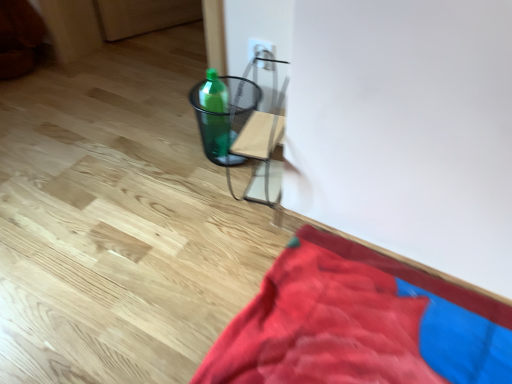
Question: Is velvet red blanket at lower right smaller than white plastic electric outlet at upper center?

Choices:
 (A) yes
 (B) no

Answer: (B)

Question: Is velvet red blanket at lower right positioned far away from white plastic electric outlet at upper center?

Choices:
 (A) yes
 (B) no

Answer: (B)

Question: Does velvet red blanket at lower right have a larger size compared to white plastic electric outlet at upper center?

Choices:
 (A) no
 (B) yes

Answer: (B)

Question: Considering the relative positions of velvet red blanket at lower right and white plastic electric outlet at upper center in the image provided, is velvet red blanket at lower right to the right of white plastic electric outlet at upper center from the viewer's perspective?

Choices:
 (A) yes
 (B) no

Answer: (A)

Question: From the image's perspective, is velvet red blanket at lower right over white plastic electric outlet at upper center?

Choices:
 (A) no
 (B) yes

Answer: (A)

Question: Can you confirm if velvet red blanket at lower right is wider than white plastic electric outlet at upper center?

Choices:
 (A) no
 (B) yes

Answer: (B)

Question: Does green plastic bottle at center have a lesser height compared to velvet red blanket at lower right?

Choices:
 (A) yes
 (B) no

Answer: (B)

Question: From a real-world perspective, is green plastic bottle at center on velvet red blanket at lower right?

Choices:
 (A) yes
 (B) no

Answer: (A)

Question: Can you confirm if green plastic bottle at center is smaller than velvet red blanket at lower right?

Choices:
 (A) no
 (B) yes

Answer: (B)

Question: Can you confirm if green plastic bottle at center is positioned to the right of velvet red blanket at lower right?

Choices:
 (A) no
 (B) yes

Answer: (A)

Question: Is velvet red blanket at lower right a part of green plastic bottle at center?

Choices:
 (A) yes
 (B) no

Answer: (B)

Question: Can we say green plastic bottle at center lies outside velvet red blanket at lower right?

Choices:
 (A) no
 (B) yes

Answer: (B)

Question: From the image's perspective, is white plastic electric outlet at upper center below green plastic bottle at center?

Choices:
 (A) no
 (B) yes

Answer: (A)